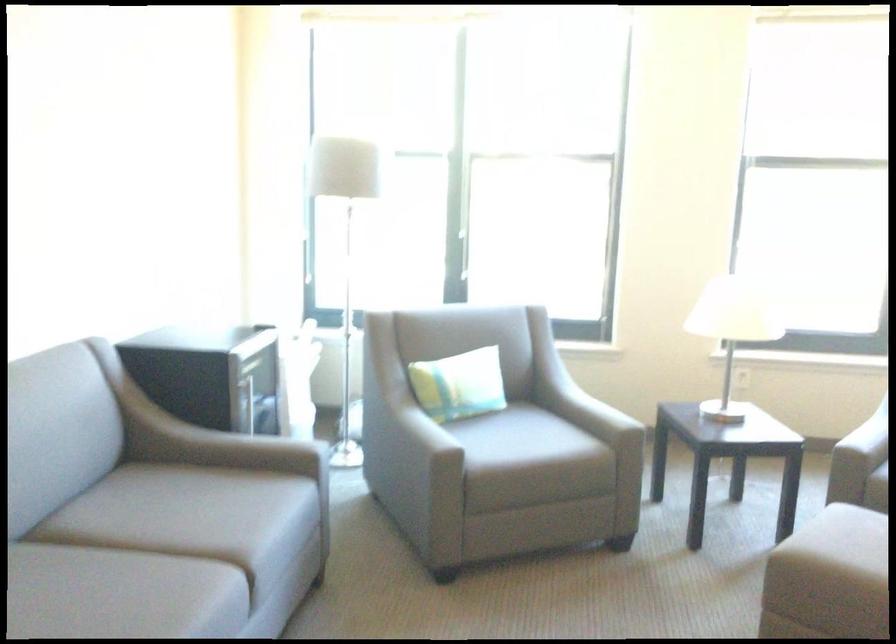
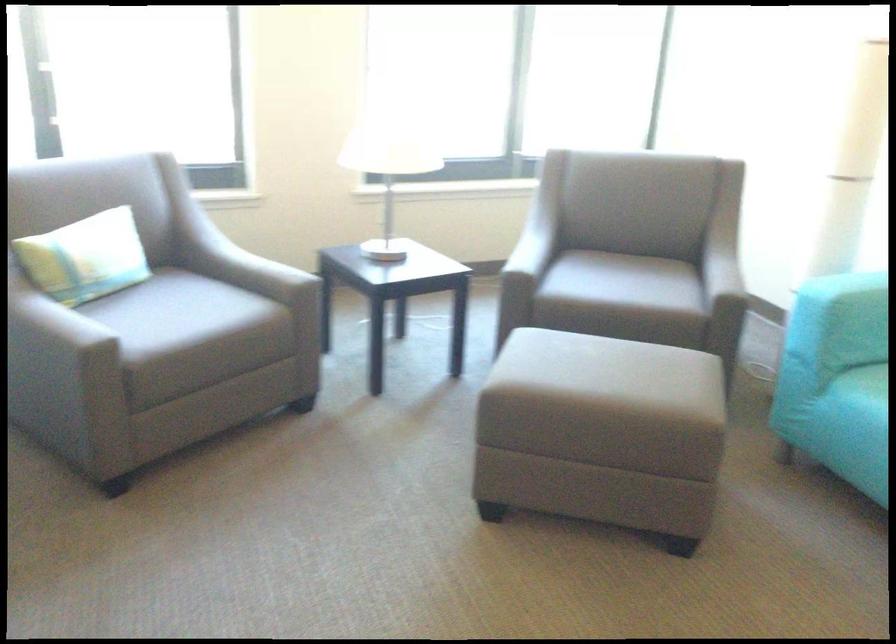
Question: How did the camera likely rotate?

Choices:
 (A) Left
 (B) Right
 (C) Up
 (D) Down

Answer: (B)